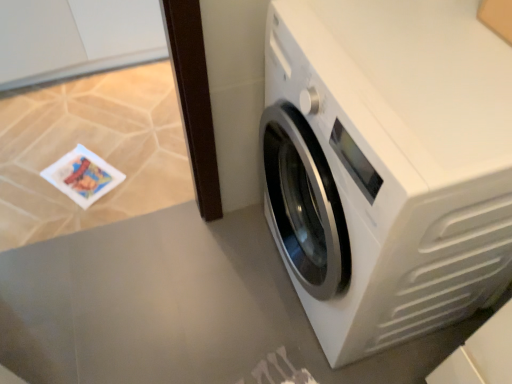
Question: Is white glossy washing machine at right far from white glossy table top at lower right?

Choices:
 (A) yes
 (B) no

Answer: (B)

Question: From the image's perspective, does white glossy washing machine at right appear higher than white glossy table top at lower right?

Choices:
 (A) yes
 (B) no

Answer: (A)

Question: From the image's perspective, does white glossy washing machine at right appear lower than white glossy table top at lower right?

Choices:
 (A) yes
 (B) no

Answer: (B)

Question: Is white glossy washing machine at right oriented away from white glossy table top at lower right?

Choices:
 (A) yes
 (B) no

Answer: (B)

Question: Does white glossy washing machine at right lie in front of white glossy table top at lower right?

Choices:
 (A) no
 (B) yes

Answer: (B)

Question: From a real-world perspective, is white glossy washing machine at right physically above white glossy table top at lower right?

Choices:
 (A) no
 (B) yes

Answer: (B)

Question: Can you confirm if white glossy table top at lower right is positioned to the right of white glossy washing machine at right?

Choices:
 (A) yes
 (B) no

Answer: (B)

Question: From the image's perspective, is white glossy table top at lower right above white glossy washing machine at right?

Choices:
 (A) no
 (B) yes

Answer: (A)

Question: Is white glossy table top at lower right thinner than white glossy washing machine at right?

Choices:
 (A) no
 (B) yes

Answer: (A)

Question: Is white glossy table top at lower right turned away from white glossy washing machine at right?

Choices:
 (A) no
 (B) yes

Answer: (A)

Question: Does white glossy table top at lower right lie in front of white glossy washing machine at right?

Choices:
 (A) no
 (B) yes

Answer: (A)

Question: From a real-world perspective, is white glossy table top at lower right under white glossy washing machine at right?

Choices:
 (A) no
 (B) yes

Answer: (B)

Question: From the image's perspective, is white glossy washing machine at right positioned above or below white glossy table top at lower right?

Choices:
 (A) above
 (B) below

Answer: (A)